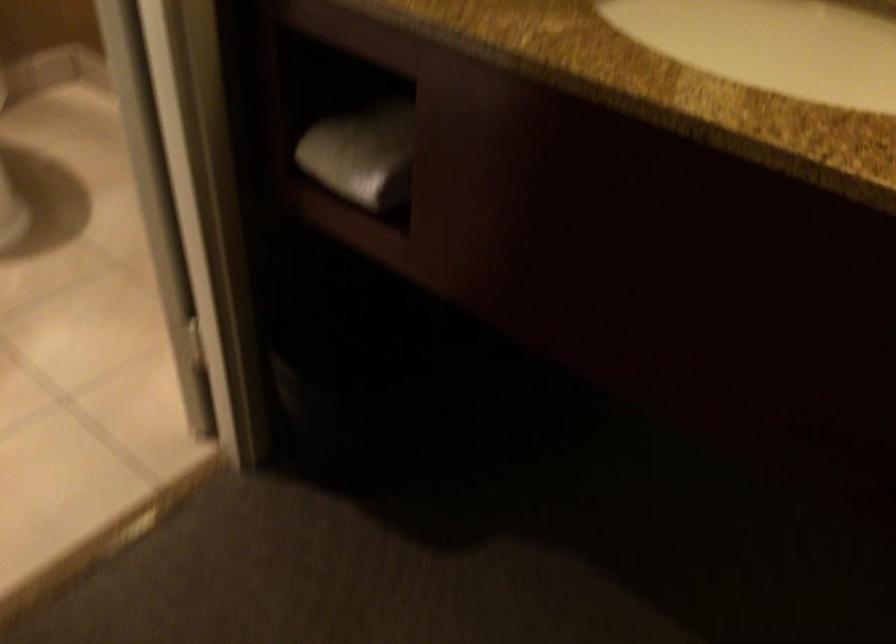
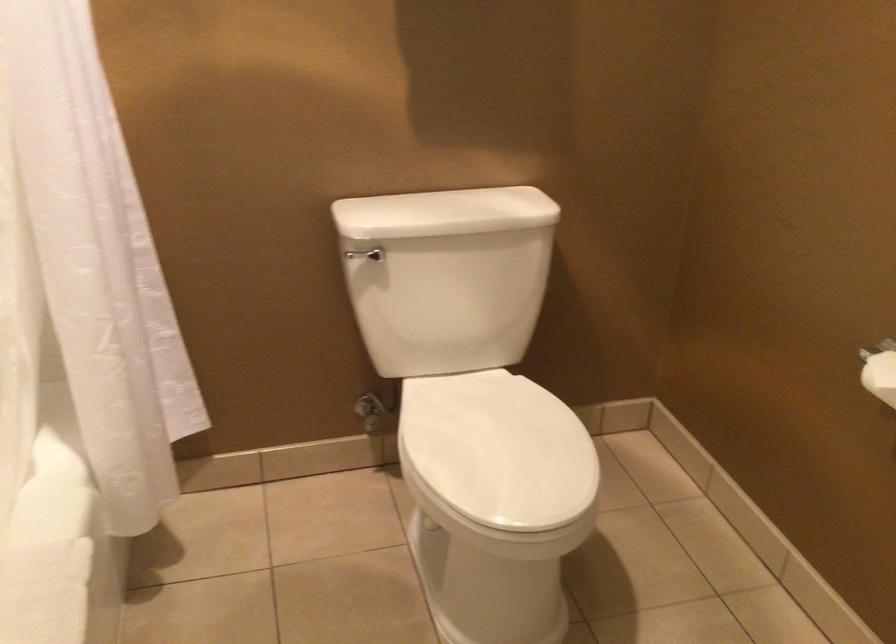
Question: The camera is either moving clockwise (left) or counter-clockwise (right) around the object. The first image is from the beginning of the video and the second image is from the end. Is the camera moving left or right when shooting the video?

Choices:
 (A) Left
 (B) Right

Answer: (B)